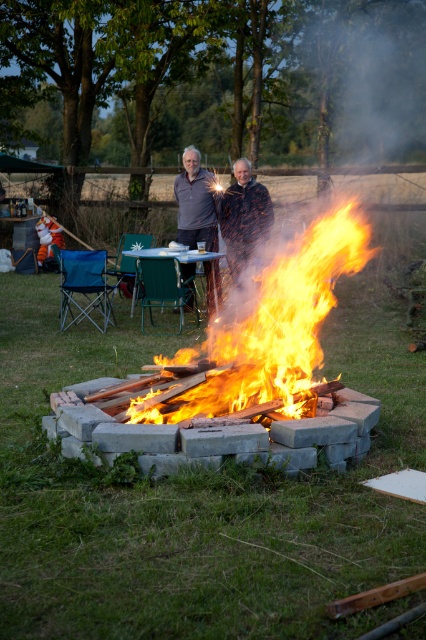
Does flaming wood at center appear on the left side of matte black jackets at center?

In fact, flaming wood at center is to the right of matte black jackets at center.

Between flaming wood at center and matte black jackets at center, which one appears on the left side from the viewer's perspective?

Positioned to the left is matte black jackets at center.

In order to click on flaming wood at center in this screenshot , I will do `click(282, 317)`.

Which is below, matte black jackets at center or green plastic picnic table at center?

green plastic picnic table at center is lower down.

Is point (187, 173) in front of point (204, 253)?

No, (187, 173) is behind (204, 253).

Is point (180, 237) farther from viewer compared to point (175, 253)?

That is True.

You are a GUI agent. You are given a task and a screenshot of the screen. Output one action in this format:
    pyautogui.click(x=<x>, y=<y>)
    Task: Click on the matte black jackets at center
    
    Given the screenshot: What is the action you would take?
    pyautogui.click(x=196, y=202)

Who is shorter, matte black jackets at center or matte gray sweater at center?

matte black jackets at center is shorter.

Locate an element on the screen. The image size is (426, 640). matte black jackets at center is located at coordinates (196, 202).